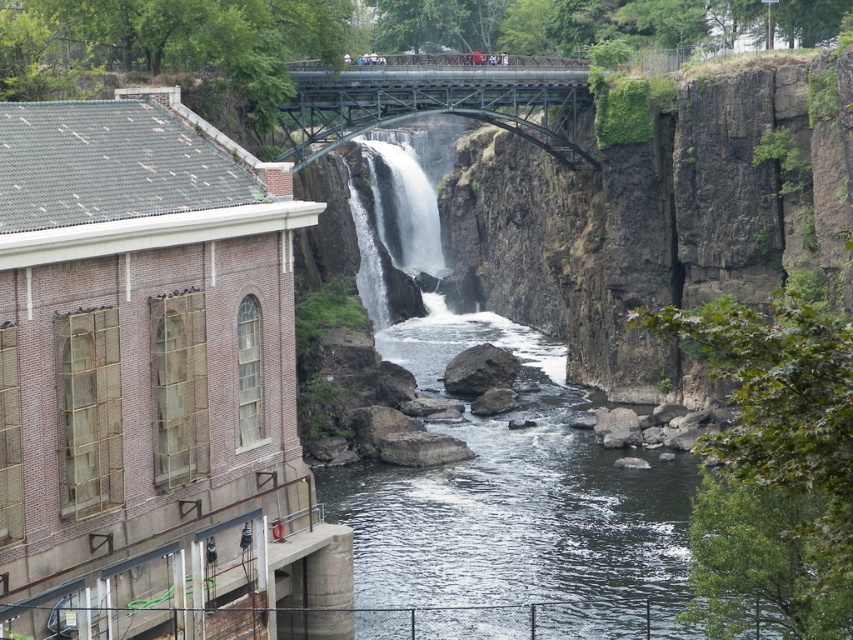
Does metallic bridge at upper center have a larger size compared to white frothy water at center?

No.

Does metallic bridge at upper center have a lesser height compared to white frothy water at center?

Yes.

You are a GUI agent. You are given a task and a screenshot of the screen. Output one action in this format:
    pyautogui.click(x=<x>, y=<y>)
    Task: Click on the metallic bridge at upper center
    Image resolution: width=853 pixels, height=640 pixels.
    Given the screenshot: What is the action you would take?
    pyautogui.click(x=438, y=106)

Is clear water at center bigger than metallic bridge at upper center?

Correct, clear water at center is larger in size than metallic bridge at upper center.

Which is below, clear water at center or metallic bridge at upper center?

Positioned lower is clear water at center.

Image resolution: width=853 pixels, height=640 pixels. I want to click on clear water at center, so click(514, 497).

Between point (520, 356) and point (358, 244), which one is positioned in front?

Point (520, 356)

Can you confirm if clear water at center is taller than white frothy water at center?

Correct, clear water at center is much taller as white frothy water at center.

The image size is (853, 640). What are the coordinates of `clear water at center` in the screenshot? It's located at (514, 497).

Where is `clear water at center`? clear water at center is located at coordinates (514, 497).